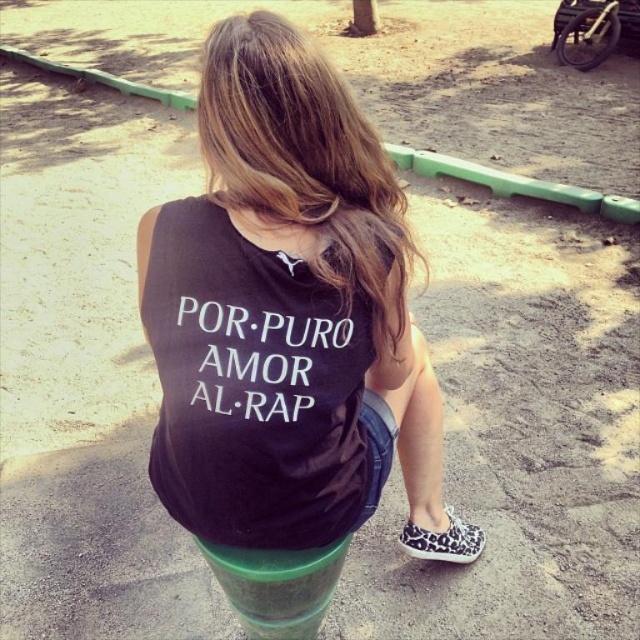
You are a fashion designer who wants to create a new line of layered tank tops. You have two tank tops available in your collection, the black matte tank top at center and the black cotton tank top at center. Given their positions, can you determine if they can be worn together in a layered style without overlapping?

The distance between the black matte tank top at center and the black cotton tank top at center is 2.23 inches, so they can be worn together in a layered style without overlapping as there is enough space between them.

You are standing in a park and see two points marked in the image. Which point, point (x=237, y=152) or point (x=214, y=317), is closer to you?

Point (x=237, y=152) is closer to the viewer than point (x=214, y=317).